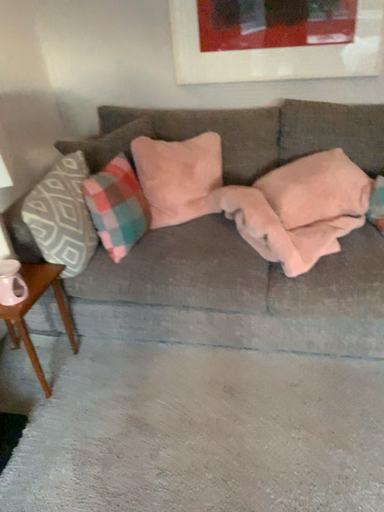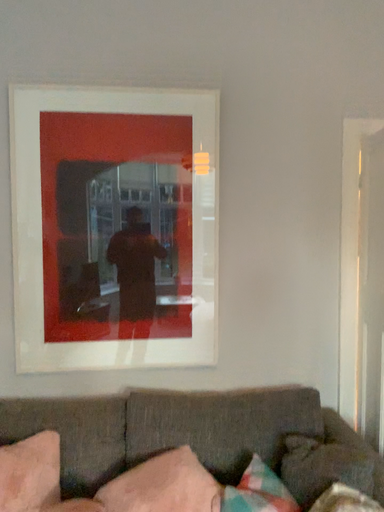
Question: Which way did the camera rotate in the video?

Choices:
 (A) rotated downward
 (B) rotated upward

Answer: (B)